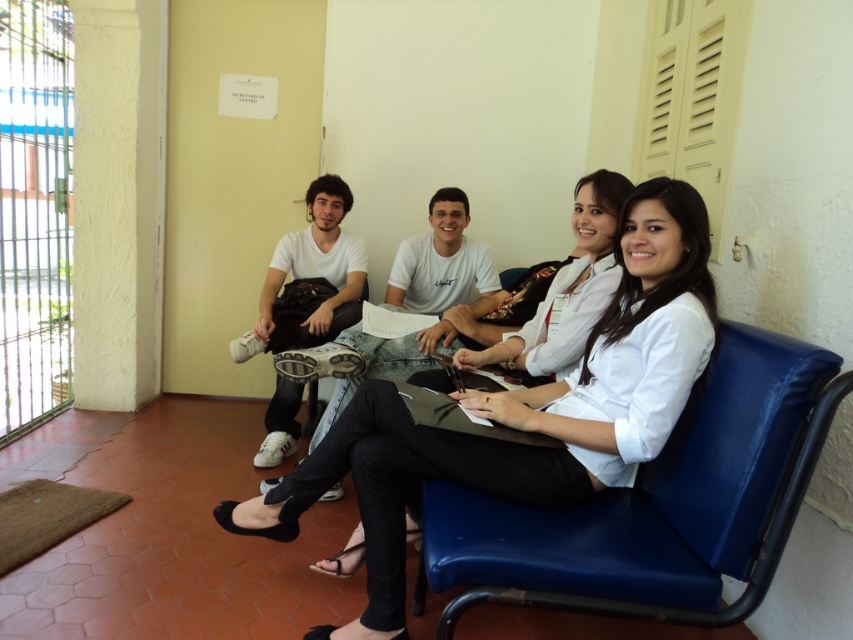
Between point (612, 557) and point (354, 276), which one is positioned behind?

Point (354, 276)

Is blue leather chair at center smaller than white matte sneakers at left?

Yes.

Between point (750, 333) and point (299, 246), which one is positioned behind?

Point (299, 246)

The image size is (853, 640). In order to click on blue leather chair at center in this screenshot , I will do (x=656, y=502).

Does blue leather chair at center have a greater width compared to white matte shirt at center?

Answer: Incorrect, blue leather chair at center's width does not surpass white matte shirt at center's.

Which is in front, point (582, 608) or point (523, 488)?

Positioned in front is point (582, 608).

Find the location of `blue leather chair at center`. blue leather chair at center is located at coordinates (656, 502).

Does white matte shirt at center lie behind white matte sneakers at left?

No, white matte shirt at center is in front of white matte sneakers at left.

Which is more to the right, white matte shirt at center or white matte sneakers at left?

white matte shirt at center is more to the right.

Who is more distant from viewer, (635,220) or (268,276)?

The point (268,276) is behind.

Locate an element on the screen. The height and width of the screenshot is (640, 853). white matte shirt at center is located at coordinates (524, 412).